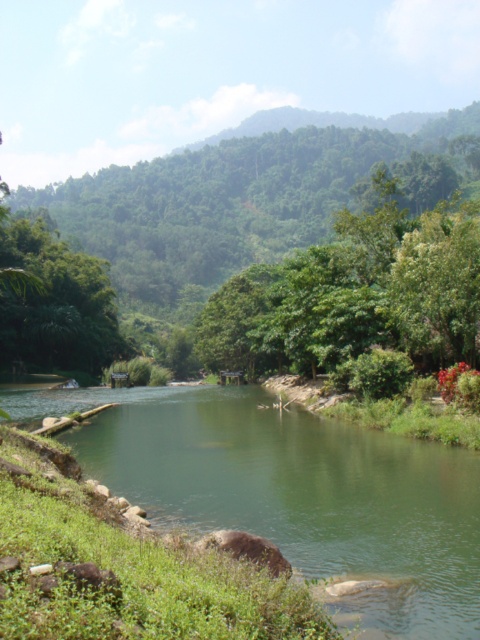
Question: Is green smooth river at center positioned before green leafy tree at center?

Choices:
 (A) no
 (B) yes

Answer: (B)

Question: Which point is farther to the camera?

Choices:
 (A) (148, 472)
 (B) (288, 204)

Answer: (B)

Question: Does green smooth river at center have a lesser width compared to green leafy tree at center?

Choices:
 (A) no
 (B) yes

Answer: (B)

Question: Among these objects, which one is nearest to the camera?

Choices:
 (A) green smooth river at center
 (B) green leafy tree at center

Answer: (A)

Question: Does green smooth river at center appear under green leafy tree at center?

Choices:
 (A) no
 (B) yes

Answer: (B)